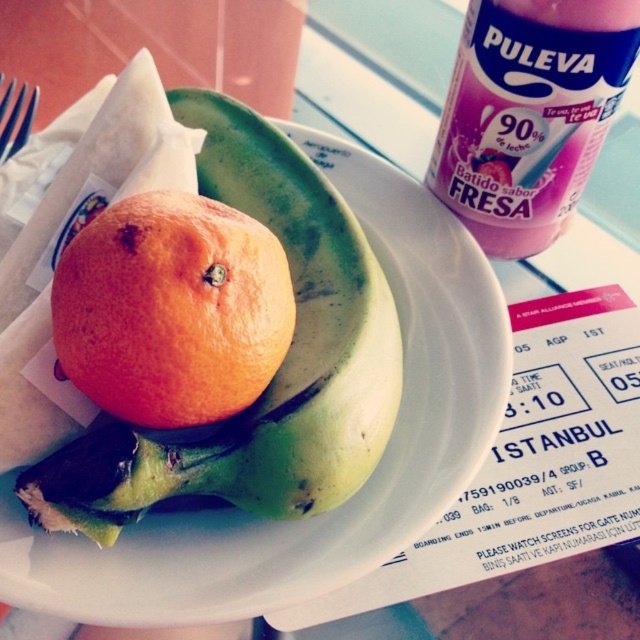
Does green matte banana at center appear on the left side of orangesmoothobject at center?

No, green matte banana at center is not to the left of orangesmoothobject at center.

Between green matte banana at center and orangesmoothobject at center, which one is positioned higher?

Positioned higher is green matte banana at center.

Where is `green matte banana at center`? green matte banana at center is located at coordinates (298, 330).

Between point (93, 531) and point (561, 198), which one is positioned in front?

Point (93, 531)

Is green matte banana at center further to camera compared to pink plastic can at upper right?

No, it is not.

The width and height of the screenshot is (640, 640). I want to click on green matte banana at center, so click(298, 330).

This screenshot has height=640, width=640. What are the coordinates of `green matte banana at center` in the screenshot? It's located at (298, 330).

Can you confirm if orangesmoothobject at center is taller than pink plastic can at upper right?

No, orangesmoothobject at center is not taller than pink plastic can at upper right.

Is orangesmoothobject at center positioned before pink plastic can at upper right?

Yes, it is in front of pink plastic can at upper right.

Identify the location of orangesmoothobject at center. (172, 308).